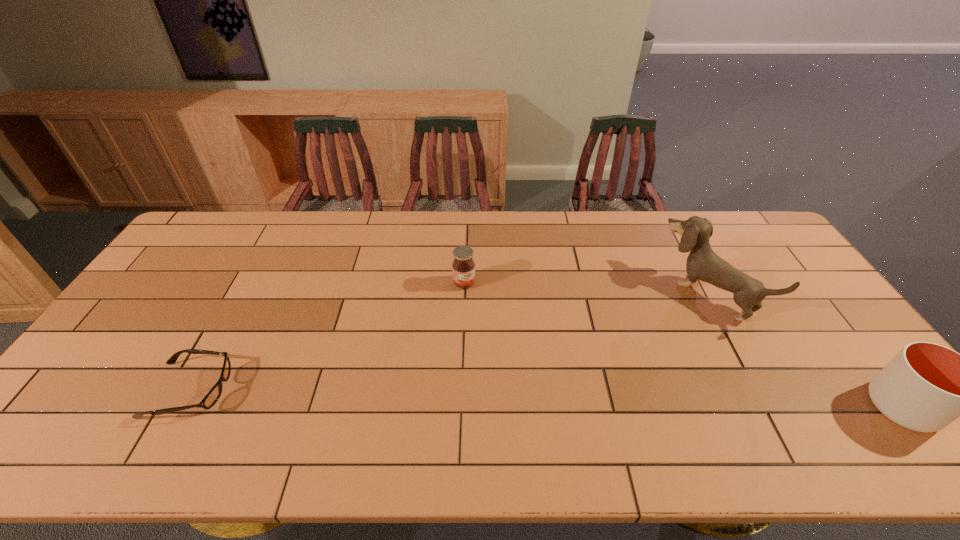
Locate an element on the screen. free spot located 0.120m at the face of the puppy is located at coordinates (660, 335).

Find the location of a particular element. The width and height of the screenshot is (960, 540). vacant area situated at the face of the puppy is located at coordinates [x=603, y=380].

Find the location of a particular element. The width and height of the screenshot is (960, 540). vacant space located at the face of the puppy is located at coordinates (613, 372).

What are the coordinates of `free point located on the label side of the jam` in the screenshot? It's located at (x=505, y=330).

Locate an element on the screen. The height and width of the screenshot is (540, 960). free space located on the label side of the jam is located at coordinates (493, 316).

The width and height of the screenshot is (960, 540). I want to click on vacant space situated 0.380m on the label side of the jam, so click(547, 379).

I want to click on spectacles that is at the near edge, so tap(211, 398).

You are a GUI agent. You are given a task and a screenshot of the screen. Output one action in this format:
    pyautogui.click(x=<x>, y=<y>)
    Task: Click on the cup located at the near edge
    The image size is (960, 540).
    Given the screenshot: What is the action you would take?
    click(925, 387)

The image size is (960, 540). Find the location of `object present at the right edge`. object present at the right edge is located at coordinates (925, 387).

You are a GUI agent. You are given a task and a screenshot of the screen. Output one action in this format:
    pyautogui.click(x=<x>, y=<y>)
    Task: Click on the object that is at the near right corner
    The width and height of the screenshot is (960, 540).
    Given the screenshot: What is the action you would take?
    pyautogui.click(x=925, y=387)